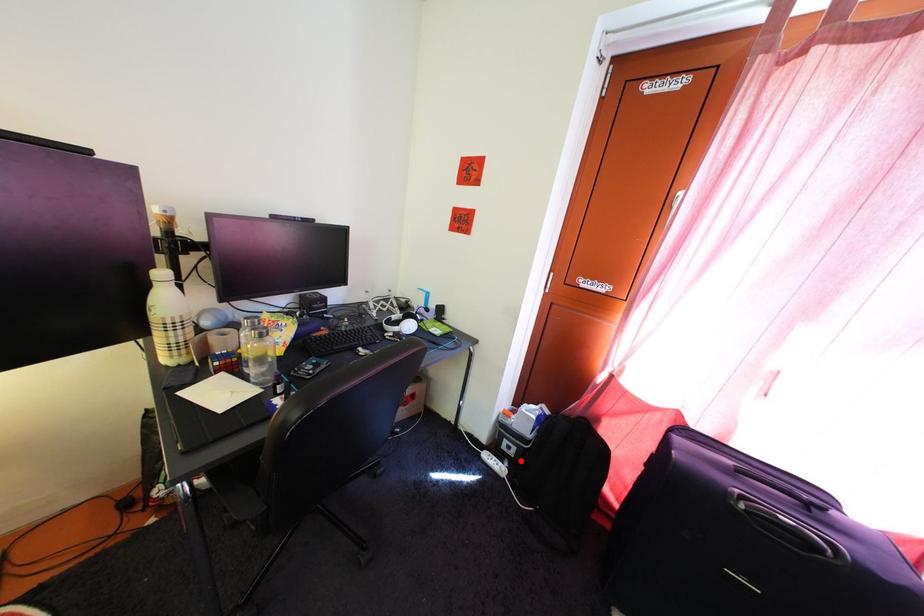
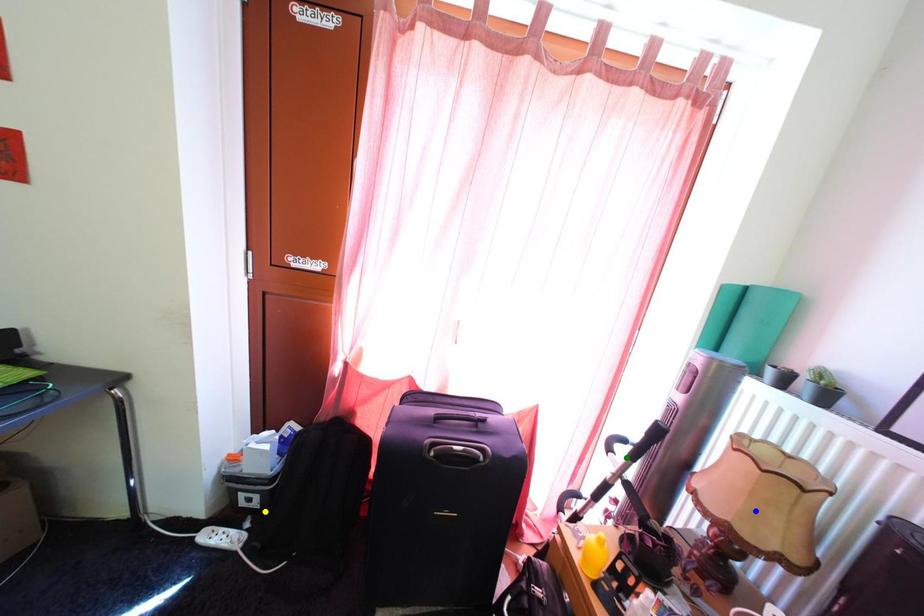
Question: I am providing you with two images of the same scene from different viewpoints. A red point is marked on the first image. You are given multiple points on the second image. In image 2, which mark is for the same physical point as the one in image 1?

Choices:
 (A) blue point
 (B) green point
 (C) yellow point

Answer: (C)